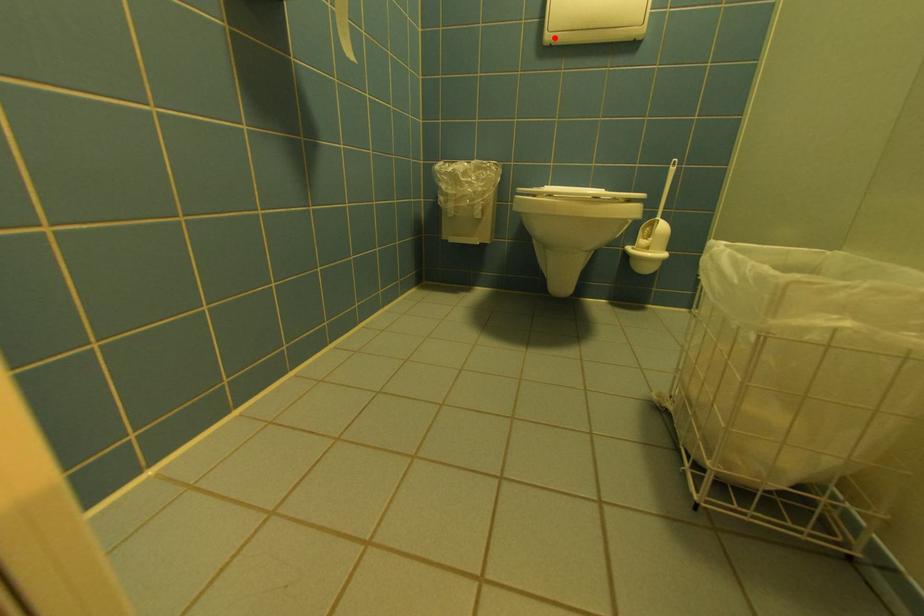
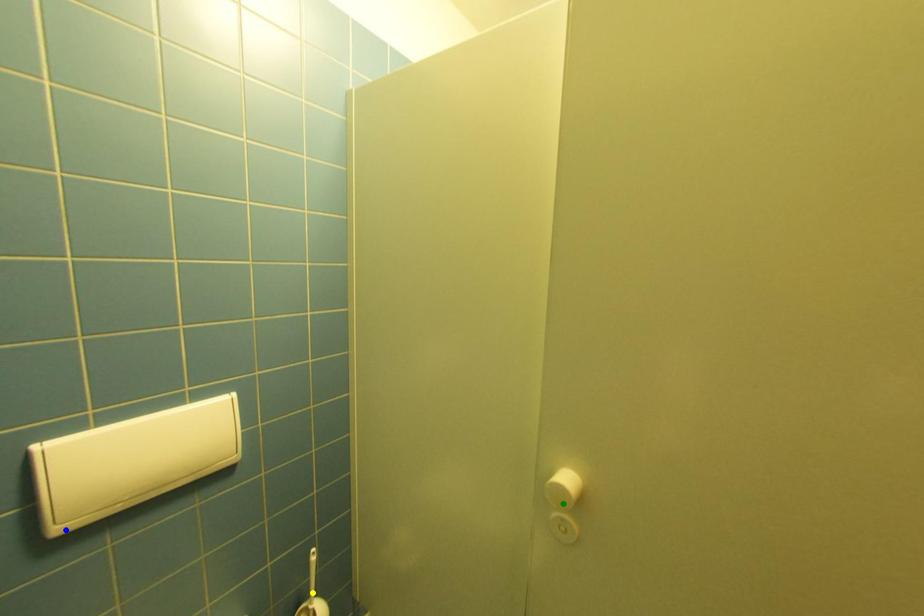
Question: I am providing you with two images of the same scene from different viewpoints. A red point is marked on the first image. You are given multiple points on the second image. Which point in image 2 is actually the same real-world point as the red point in image 1?

Choices:
 (A) green point
 (B) yellow point
 (C) blue point

Answer: (C)